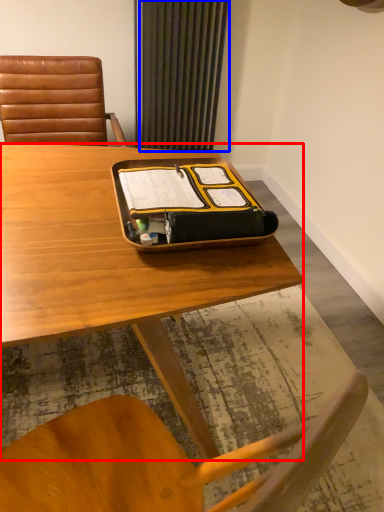
Question: Among these objects, which one is farthest to the camera, desk (highlighted by a red box) or curtain (highlighted by a blue box)?

Choices:
 (A) desk
 (B) curtain

Answer: (B)